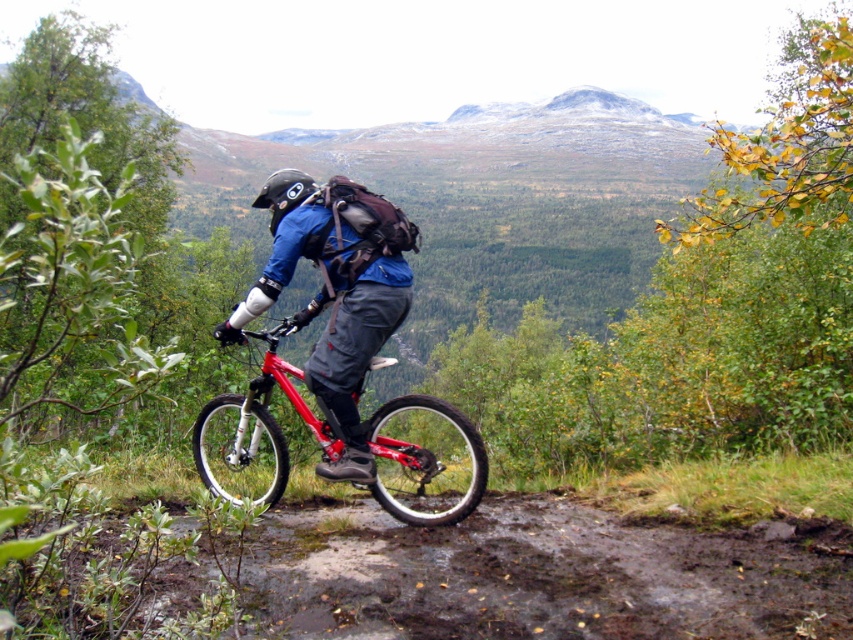
You are a hiker planning to cross the brown muddy dirt track at lower center. You notice the matte blue jacket at center nearby. Which object is closer to the ground?

The brown muddy dirt track at lower center is positioned under matte blue jacket at center, so the dirt track is closer to the ground.

You are a mountain biker planning your route. You see the brown muddy dirt track at lower center and the black matte helmet at center. Which object is wider?

The brown muddy dirt track at lower center is wider than the black matte helmet at center.